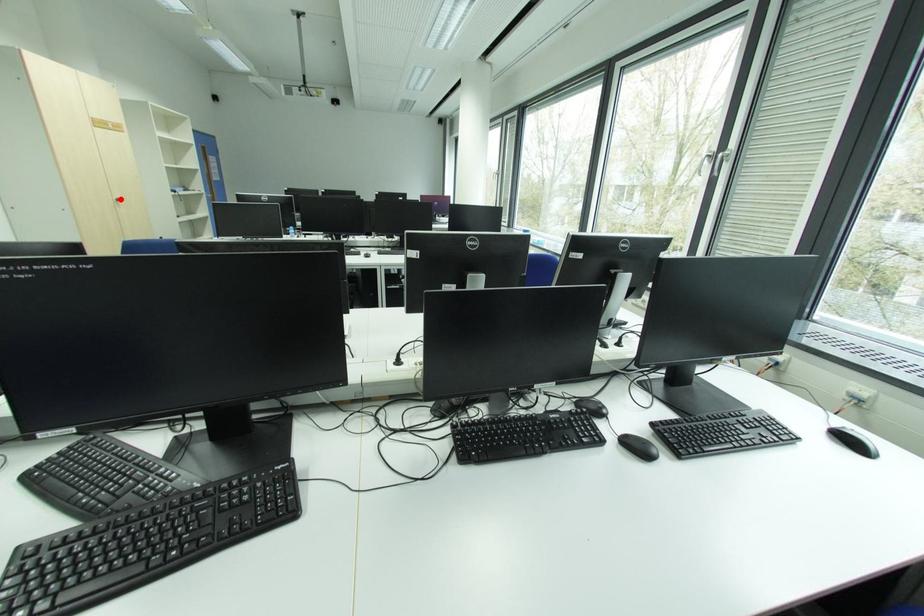
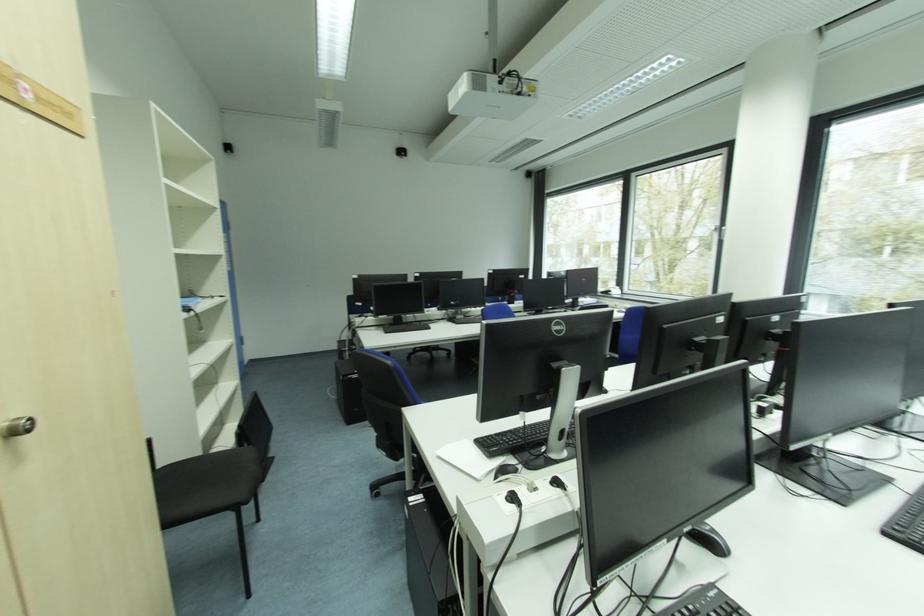
Find the pixel in the second image that matches the highlighted location in the first image.

(6, 424)